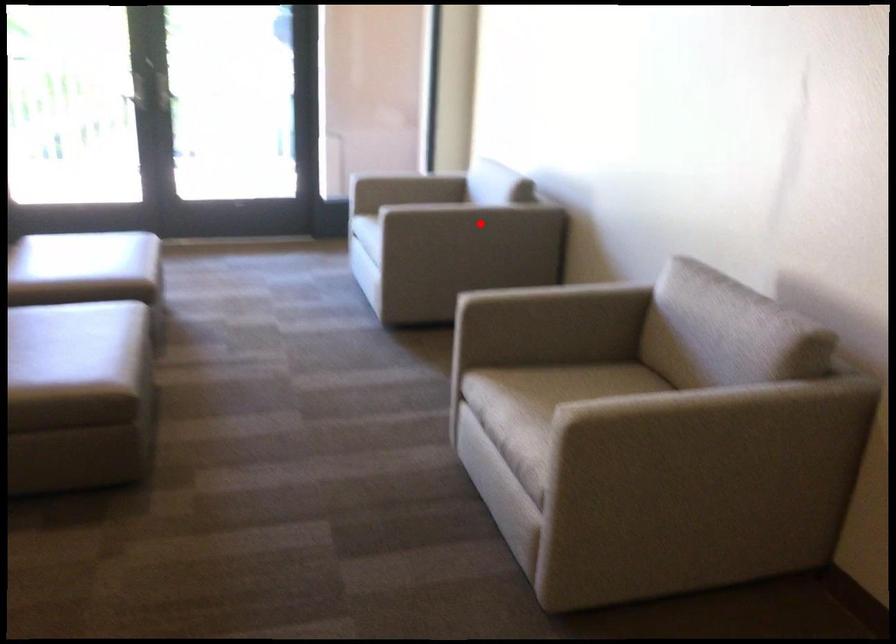
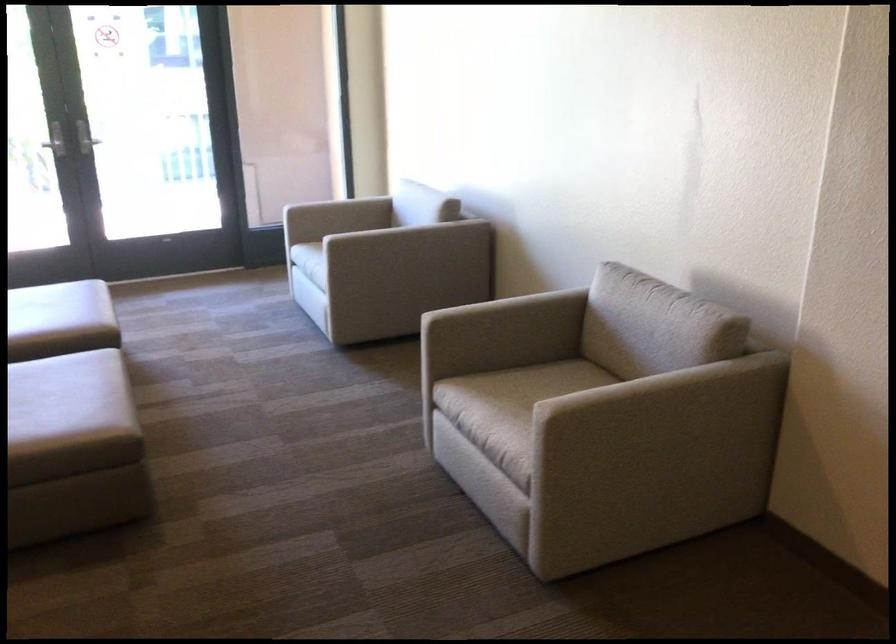
Find the pixel in the second image that matches the highlighted location in the first image.

(417, 242)